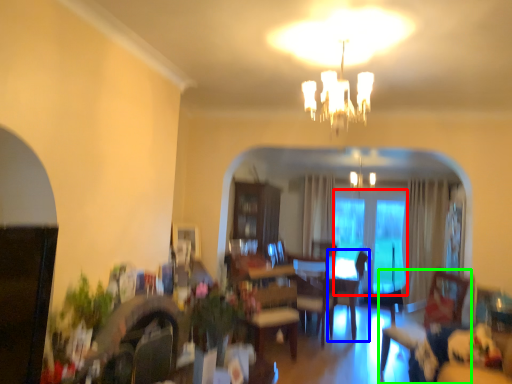
Question: Which object is the farthest from glass door (highlighted by a red box)? Choose among these: armchair (highlighted by a blue box) or swivel chair (highlighted by a green box).

Choices:
 (A) armchair
 (B) swivel chair

Answer: (B)